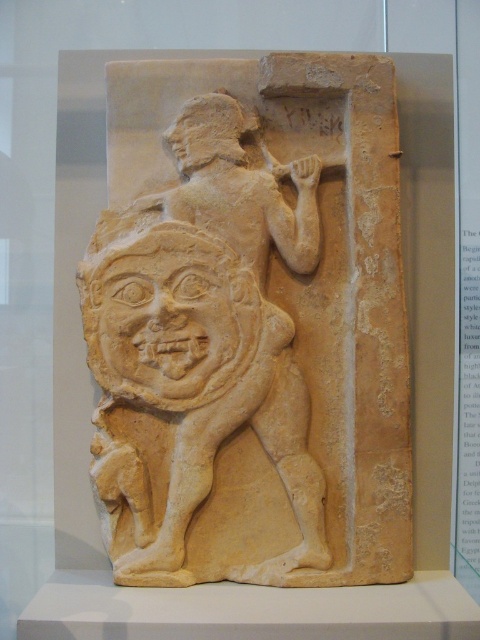
Does point (388, 497) come closer to viewer compared to point (216, 224)?

No, it is behind (216, 224).

Is beige stone relief at center smaller than beige stone warrior at center?

Actually, beige stone relief at center might be larger than beige stone warrior at center.

Who is more distant from viewer, (345, 532) or (301, 188)?

Positioned behind is point (301, 188).

Locate an element on the screen. The width and height of the screenshot is (480, 640). beige stone relief at center is located at coordinates (251, 324).